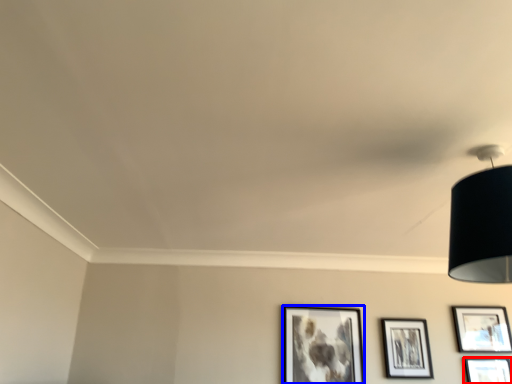
Question: Which object appears farthest to the camera in this image, picture frame (highlighted by a red box) or picture frame (highlighted by a blue box)?

Choices:
 (A) picture frame
 (B) picture frame

Answer: (B)